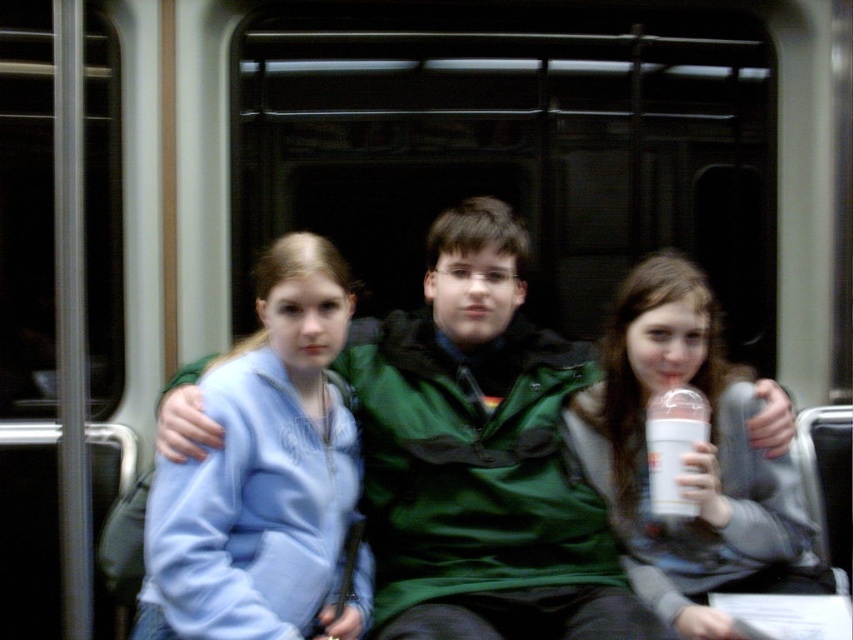
Is the position of white plastic cup at center less distant than that of white plastic bottle at center?

Yes, it is.

Does white plastic cup at center have a lesser width compared to white plastic bottle at center?

No.

Between point (631, 333) and point (685, 412), which one is positioned in front?

Point (685, 412)

In order to click on white plastic cup at center in this screenshot , I will do tap(692, 456).

Between green matte jacket at center and white plastic cup at center, which one is positioned lower?

white plastic cup at center is below.

Is point (440, 378) positioned after point (650, 595)?

Yes, point (440, 378) is behind point (650, 595).

This screenshot has height=640, width=853. I want to click on green matte jacket at center, so click(480, 456).

Is green matte jacket at center to the left of white plastic bottle at center from the viewer's perspective?

Correct, you'll find green matte jacket at center to the left of white plastic bottle at center.

Is green matte jacket at center shorter than white plastic bottle at center?

No, green matte jacket at center is not shorter than white plastic bottle at center.

Between point (445, 230) and point (699, 394), which one is positioned behind?

The point (445, 230) is more distant.

This screenshot has height=640, width=853. I want to click on green matte jacket at center, so (x=480, y=456).